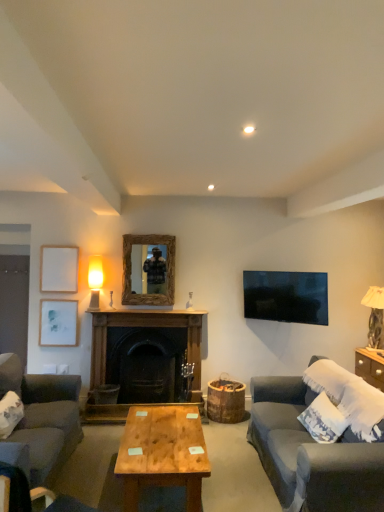
This screenshot has height=512, width=384. I want to click on dark gray fabric couch at lower left, which is the 2th studio couch in front-to-back order, so click(x=41, y=420).

This screenshot has width=384, height=512. Describe the element at coordinates (35, 494) in the screenshot. I see `dark gray fabric chair at lower left` at that location.

Where is `white matte picture frame at upper left, which is counted as the 2th picture frame, starting from the bottom`? Image resolution: width=384 pixels, height=512 pixels. white matte picture frame at upper left, which is counted as the 2th picture frame, starting from the bottom is located at coordinates (59, 269).

What do you see at coordinates (59, 269) in the screenshot? Image resolution: width=384 pixels, height=512 pixels. I see `white matte picture frame at upper left, which is counted as the 2th picture frame, starting from the bottom` at bounding box center [59, 269].

Find the location of `matte glass table lamp at upper left, marked as the first table lamp in a left-to-right arrangement`. matte glass table lamp at upper left, marked as the first table lamp in a left-to-right arrangement is located at coordinates (95, 281).

What is the approximate width of white matte picture frame at upper left, positioned as the first picture frame in bottom-to-top order?

The width of white matte picture frame at upper left, positioned as the first picture frame in bottom-to-top order, is 1.66 inches.

What is the approximate height of white matte picture frame at upper left, marked as the 2th picture frame in a top-to-bottom arrangement?

The height of white matte picture frame at upper left, marked as the 2th picture frame in a top-to-bottom arrangement, is 20.40 inches.

The height and width of the screenshot is (512, 384). Identify the location of natural wood coffee table at center. (162, 453).

Find the location of `the 2nd picture frame directly above the dark gray fabric couch at lower right, which is counted as the second studio couch, starting from the back (from a real-world perspective)`. the 2nd picture frame directly above the dark gray fabric couch at lower right, which is counted as the second studio couch, starting from the back (from a real-world perspective) is located at coordinates (59, 269).

Is dark gray fabric couch at lower right, which is counted as the second studio couch, starting from the back, not within white matte picture frame at upper left, which is the 1th picture frame in top-to-bottom order?

Indeed, dark gray fabric couch at lower right, which is counted as the second studio couch, starting from the back, is completely outside white matte picture frame at upper left, which is the 1th picture frame in top-to-bottom order.

Does point (292, 412) come behind point (49, 266)?

No, it is in front of (49, 266).

Is white textured pillow at right located within dark wood fireplace at center?

Definitely not — white textured pillow at right is not inside dark wood fireplace at center.

Considering the points (195, 314) and (334, 430), which point is behind, point (195, 314) or point (334, 430)?

The point (195, 314) is farther from the camera.

Can you confirm if dark wood fireplace at center is taller than white textured pillow at right?

Yes, dark wood fireplace at center is taller than white textured pillow at right.

Looking at this image, is dark wood fireplace at center facing towards white textured pillow at right?

No, dark wood fireplace at center is not aimed at white textured pillow at right.

Does point (150, 417) appear closer or farther from the camera than point (55, 279)?

Clearly, point (150, 417) is closer to the camera than point (55, 279).

How different are the orientations of natural wood coffee table at center and white matte picture frame at upper left, which is counted as the 2th picture frame, starting from the bottom, in degrees?

The angular difference between natural wood coffee table at center and white matte picture frame at upper left, which is counted as the 2th picture frame, starting from the bottom, is 90 degrees.

Would you say natural wood coffee table at center is inside or outside white matte picture frame at upper left, which is counted as the 2th picture frame, starting from the bottom?

natural wood coffee table at center lies outside white matte picture frame at upper left, which is counted as the 2th picture frame, starting from the bottom.

Considering the relative positions of natural wood coffee table at center and white matte picture frame at upper left, which is the 1th picture frame in top-to-bottom order, in the image provided, is natural wood coffee table at center to the right of white matte picture frame at upper left, which is the 1th picture frame in top-to-bottom order, from the viewer's perspective?

Indeed, natural wood coffee table at center is positioned on the right side of white matte picture frame at upper left, which is the 1th picture frame in top-to-bottom order.

What's the angular difference between natural wood coffee table at center and dark wood fireplace at center's facing directions?

90 degrees.

From a real-world perspective, does natural wood coffee table at center sit lower than dark wood fireplace at center?

Yes, from a real-world perspective, natural wood coffee table at center is beneath dark wood fireplace at center.

Which of these two, natural wood coffee table at center or dark wood fireplace at center, is smaller?

natural wood coffee table at center.

Is natural wood coffee table at center outside of dark wood fireplace at center?

natural wood coffee table at center lies outside dark wood fireplace at center's area.

Is white textured pillow at right at the right side of dark gray fabric chair at lower left?

Yes, white textured pillow at right is to the right of dark gray fabric chair at lower left.

Is white textured pillow at right situated inside dark gray fabric chair at lower left or outside?

white textured pillow at right is located beyond the bounds of dark gray fabric chair at lower left.

Between white textured pillow at right and dark gray fabric chair at lower left, which one has more height?

white textured pillow at right.

From the image's perspective, would you say white textured pillow at right is positioned over dark gray fabric chair at lower left?

Incorrect, from the image's perspective, white textured pillow at right is lower than dark gray fabric chair at lower left.

Visually, is dark gray fabric chair at lower left positioned to the left or to the right of dark wood fireplace at center?

Clearly, dark gray fabric chair at lower left is on the left of dark wood fireplace at center in the image.

In terms of width, does dark gray fabric chair at lower left look wider or thinner when compared to dark wood fireplace at center?

Considering their sizes, dark gray fabric chair at lower left looks broader than dark wood fireplace at center.

Could you tell me if dark gray fabric chair at lower left is turned towards dark wood fireplace at center?

No, dark gray fabric chair at lower left is not facing towards dark wood fireplace at center.

Between white textured pillow at right and white matte picture frame at upper left, marked as the 2th picture frame in a top-to-bottom arrangement, which one has larger size?

white textured pillow at right.

The width and height of the screenshot is (384, 512). Identify the location of the 1st picture frame above when counting from the white textured pillow at right (from the image's perspective). (58, 322).

Does white textured pillow at right appear on the left side of white matte picture frame at upper left, positioned as the first picture frame in bottom-to-top order?

In fact, white textured pillow at right is to the right of white matte picture frame at upper left, positioned as the first picture frame in bottom-to-top order.

Does white textured pillow at right have a lesser height compared to white matte picture frame at upper left, marked as the 2th picture frame in a top-to-bottom arrangement?

No.

Starting from the white matte picture frame at upper left, which is counted as the 2th picture frame, starting from the bottom, which studio couch is the 2nd one to the right? Please provide its 2D coordinates.

[(311, 453)]

Find the location of `fireplace on the left of white textured pillow at right`. fireplace on the left of white textured pillow at right is located at coordinates click(144, 361).

Looking at the image, which one is located further to white matte picture frame at upper left, which is counted as the 2th picture frame, starting from the bottom, white matte picture frame at upper left, positioned as the first picture frame in bottom-to-top order, or dark gray fabric couch at lower left, which is counted as the 1th studio couch, starting from the back?

dark gray fabric couch at lower left, which is counted as the 1th studio couch, starting from the back, is further to white matte picture frame at upper left, which is counted as the 2th picture frame, starting from the bottom.

Which object lies nearer to the anchor point dark gray fabric couch at lower left, which is counted as the 1th studio couch, starting from the back, dark gray fabric chair at lower left or matte glass table lamp at upper left, the 2th table lamp when ordered from right to left?

dark gray fabric chair at lower left is positioned closer to the anchor dark gray fabric couch at lower left, which is counted as the 1th studio couch, starting from the back.

Estimate the real-world distances between objects in this image. Which object is further from natural wood coffee table at center, white matte picture frame at upper left, positioned as the first picture frame in bottom-to-top order, or dark wood fireplace at center?

Based on the image, white matte picture frame at upper left, positioned as the first picture frame in bottom-to-top order, appears to be further to natural wood coffee table at center.

Based on the photo, which object lies further to the anchor point white textured pillow at right, dark wood fireplace at center or matte glass table lamp at upper left, marked as the first table lamp in a left-to-right arrangement?

matte glass table lamp at upper left, marked as the first table lamp in a left-to-right arrangement, is further to white textured pillow at right.

Considering their positions, is dark gray fabric couch at lower right, the 1th studio couch from the front, positioned further to dark wood fireplace at center than natural wood coffee table at center?

dark gray fabric couch at lower right, the 1th studio couch from the front, is further to dark wood fireplace at center.

Which object lies further to the anchor point white textured pillow at right, dark gray fabric chair at lower left or white matte picture frame at upper left, which is the 1th picture frame in top-to-bottom order?

white matte picture frame at upper left, which is the 1th picture frame in top-to-bottom order, is further to white textured pillow at right.

Considering their positions, is dark gray fabric couch at lower left, which is the 2th studio couch in front-to-back order, positioned closer to dark gray fabric couch at lower right, which is counted as the second studio couch, starting from the back, than matte glass table lamp at upper left, marked as the first table lamp in a left-to-right arrangement?

Based on the image, dark gray fabric couch at lower left, which is the 2th studio couch in front-to-back order, appears to be nearer to dark gray fabric couch at lower right, which is counted as the second studio couch, starting from the back.

Estimate the real-world distances between objects in this image. Which object is further from dark gray fabric chair at lower left, white matte picture frame at upper left, positioned as the first picture frame in bottom-to-top order, or white matte picture frame at upper left, which is the 1th picture frame in top-to-bottom order?

The object further to dark gray fabric chair at lower left is white matte picture frame at upper left, which is the 1th picture frame in top-to-bottom order.

What are the coordinates of `mirror situated between white matte picture frame at upper left, positioned as the first picture frame in bottom-to-top order, and dark wood fireplace at center from left to right` in the screenshot? It's located at (130, 270).

Locate an element on the screen. Image resolution: width=384 pixels, height=512 pixels. fireplace situated between white matte picture frame at upper left, marked as the 2th picture frame in a top-to-bottom arrangement, and white textured pillow at right from left to right is located at coordinates (144, 361).

The image size is (384, 512). In order to click on studio couch located between dark gray fabric couch at lower right, marked as the 1th studio couch in a right-to-left arrangement, and white matte picture frame at upper left, marked as the 2th picture frame in a top-to-bottom arrangement, in the depth direction in this screenshot , I will do click(41, 420).

At what (x,y) coordinates should I click in order to perform the action: click on fireplace between white matte picture frame at upper left, which is the 1th picture frame in top-to-bottom order, and white textured pillow at right, in the horizontal direction. Please return your answer as a coordinate pair (x, y). The width and height of the screenshot is (384, 512). Looking at the image, I should click on (144, 361).